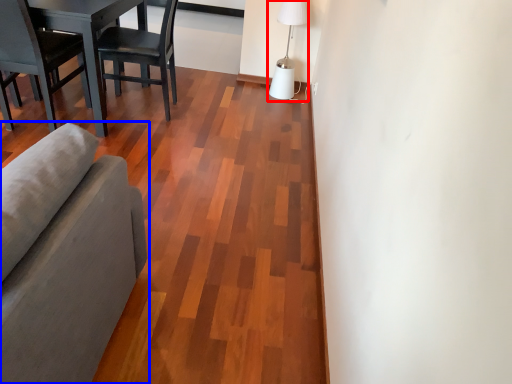
Question: Which object is closer to the camera taking this photo, table lamp (highlighted by a red box) or studio couch (highlighted by a blue box)?

Choices:
 (A) table lamp
 (B) studio couch

Answer: (B)